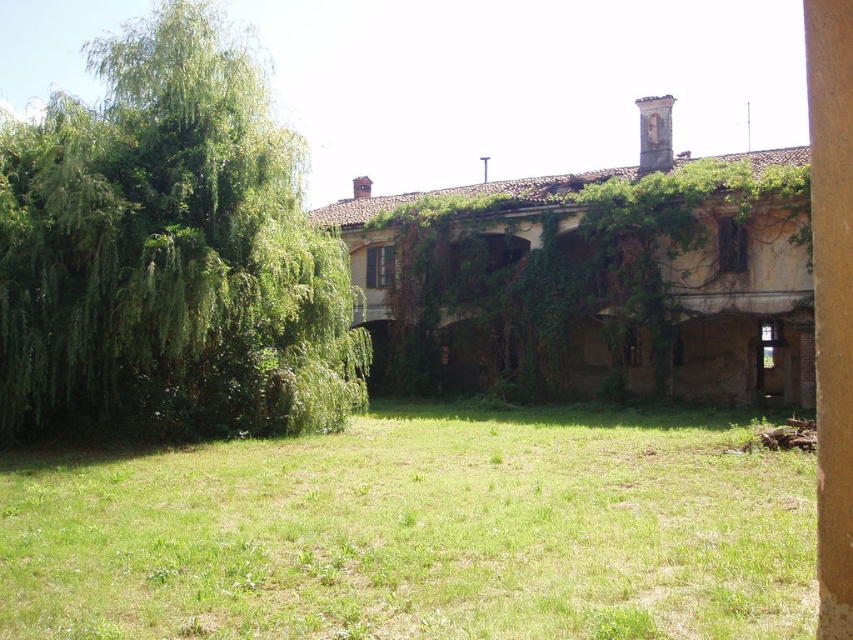
Question: Can you confirm if green grass at lower center is positioned below green leafy tree at left?

Choices:
 (A) no
 (B) yes

Answer: (B)

Question: Which point is closer to the camera?

Choices:
 (A) (6, 544)
 (B) (337, 307)

Answer: (A)

Question: Is green grass at lower center above green leafy tree at left?

Choices:
 (A) no
 (B) yes

Answer: (A)

Question: From the image, what is the correct spatial relationship of green grass at lower center in relation to green leafy tree at left?

Choices:
 (A) left
 (B) right

Answer: (B)

Question: Which object appears closest to the camera in this image?

Choices:
 (A) green grass at lower center
 (B) green leafy tree at left

Answer: (A)